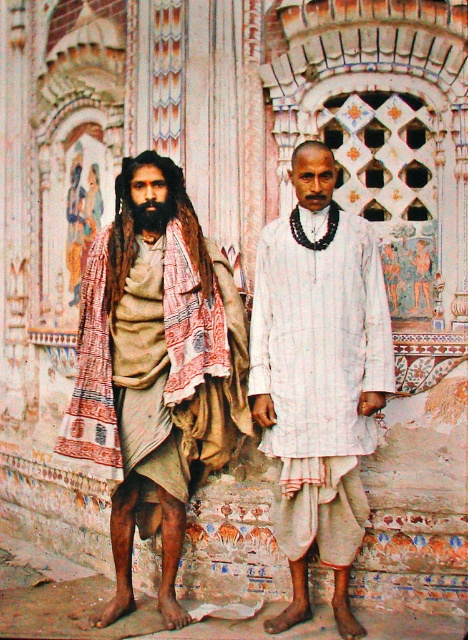
Between beige fabric draped at left and black fuzzy beard at left, which one is positioned lower?

Positioned lower is beige fabric draped at left.

Is point (168, 621) closer to camera compared to point (138, 220)?

Yes, it is in front of point (138, 220).

What are the coordinates of `beige fabric draped at left` in the screenshot? It's located at (x=155, y=372).

Between beige fabric draped at left and white striped shirt at center, which one appears on the right side from the viewer's perspective?

white striped shirt at center is more to the right.

Who is higher up, beige fabric draped at left or white striped shirt at center?

beige fabric draped at left

Is point (86, 288) positioned after point (302, 362)?

Yes.

Where is `beige fabric draped at left`? The image size is (468, 640). beige fabric draped at left is located at coordinates (155, 372).

Does white striped shirt at center come behind black fuzzy beard at left?

No, it is not.

Can you confirm if white striped shirt at center is positioned to the left of black fuzzy beard at left?

In fact, white striped shirt at center is to the right of black fuzzy beard at left.

Does point (311, 353) lie in front of point (150, 204)?

Yes, point (311, 353) is closer to viewer.

You are a GUI agent. You are given a task and a screenshot of the screen. Output one action in this format:
    pyautogui.click(x=<x>, y=<y>)
    Task: Click on the white striped shirt at center
    Image resolution: width=468 pixels, height=640 pixels.
    Given the screenshot: What is the action you would take?
    pyautogui.click(x=319, y=378)